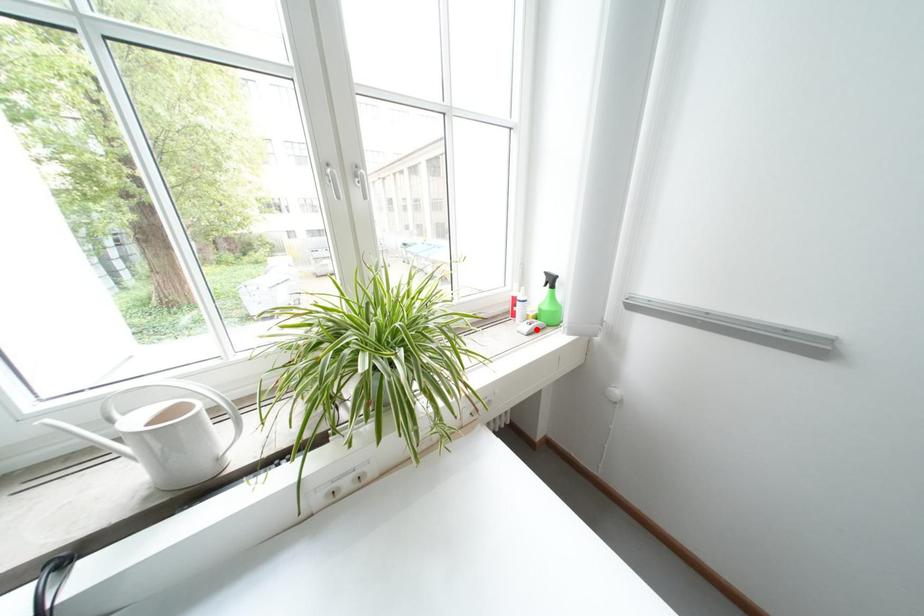
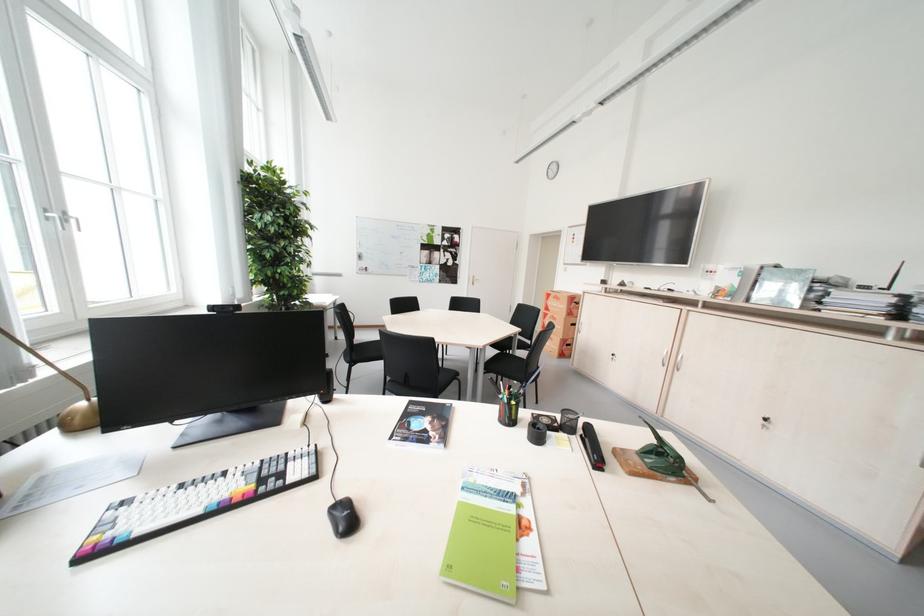
Question: I am providing you with two images of the same scene from different viewpoints. A red point is marked on the first image. Is the red point's position out of view in image 2?

Choices:
 (A) Yes
 (B) No

Answer: (A)